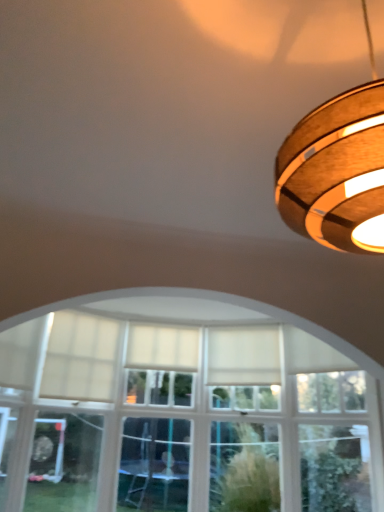
The height and width of the screenshot is (512, 384). What do you see at coordinates (163, 346) in the screenshot?
I see `white fabric curtain at center, which is counted as the first curtain, starting from the right` at bounding box center [163, 346].

What do you see at coordinates (80, 358) in the screenshot?
I see `white sheer curtain at center, the second curtain positioned from the right` at bounding box center [80, 358].

At what (x,y) coordinates should I click in order to perform the action: click on wooden ring light at upper right. Please return your answer as a coordinate pair (x, y). This screenshot has height=512, width=384. Looking at the image, I should click on (336, 172).

In terms of height, does white sheer curtain at center, which is counted as the first curtain, starting from the left, look taller or shorter compared to white fabric curtain at center, which is counted as the first curtain, starting from the right?

white sheer curtain at center, which is counted as the first curtain, starting from the left, is taller than white fabric curtain at center, which is counted as the first curtain, starting from the right.

Is white sheer curtain at center, which is counted as the first curtain, starting from the left, behind white fabric curtain at center, the 2th curtain when ordered from left to right?

No, white sheer curtain at center, which is counted as the first curtain, starting from the left, is closer to the camera.

Choose the correct answer: Is white sheer curtain at center, which is counted as the first curtain, starting from the left, inside white fabric curtain at center, which is counted as the first curtain, starting from the right, or outside it?

white sheer curtain at center, which is counted as the first curtain, starting from the left, is located beyond the bounds of white fabric curtain at center, which is counted as the first curtain, starting from the right.

Between white fabric curtain at center, which is counted as the first curtain, starting from the right, and white sheer curtain at center, which is counted as the first curtain, starting from the left, which one has smaller width?

Thinner between the two is white sheer curtain at center, which is counted as the first curtain, starting from the left.

Measure the distance from white fabric curtain at center, the 2th curtain when ordered from left to right, to white sheer curtain at center, the second curtain positioned from the right.

19.10 inches.

Which is more to the left, white fabric curtain at center, the 2th curtain when ordered from left to right, or white sheer curtain at center, the second curtain positioned from the right?

white sheer curtain at center, the second curtain positioned from the right, is more to the left.

Consider the image. From a real-world perspective, who is located higher, white fabric curtain at center, the 2th curtain when ordered from left to right, or white sheer curtain at center, which is counted as the first curtain, starting from the left?

In real-world perspective, white fabric curtain at center, the 2th curtain when ordered from left to right, is above.

Who is shorter, wooden ring light at upper right or white sheer curtain at center, the second curtain positioned from the right?

With less height is white sheer curtain at center, the second curtain positioned from the right.

In terms of size, does wooden ring light at upper right appear bigger or smaller than white sheer curtain at center, the second curtain positioned from the right?

Considering their sizes, wooden ring light at upper right takes up more space than white sheer curtain at center, the second curtain positioned from the right.

Is wooden ring light at upper right oriented away from white sheer curtain at center, which is counted as the first curtain, starting from the left?

Correct, wooden ring light at upper right is looking away from white sheer curtain at center, which is counted as the first curtain, starting from the left.

Locate an element on the screen. The width and height of the screenshot is (384, 512). lamp to the right of white sheer curtain at center, which is counted as the first curtain, starting from the left is located at coordinates (336, 172).

Considering the points (112, 381) and (367, 152), which point is behind, point (112, 381) or point (367, 152)?

The point (112, 381) is farther.

Where is `curtain that is the 2nd one below the wooden ring light at upper right (from a real-world perspective)`? Image resolution: width=384 pixels, height=512 pixels. curtain that is the 2nd one below the wooden ring light at upper right (from a real-world perspective) is located at coordinates (x=80, y=358).

From the image's perspective, which is below, white sheer curtain at center, which is counted as the first curtain, starting from the left, or wooden ring light at upper right?

From the image's view, white sheer curtain at center, which is counted as the first curtain, starting from the left, is below.

Can you confirm if white sheer curtain at center, the second curtain positioned from the right, is positioned to the left of wooden ring light at upper right?

Correct, you'll find white sheer curtain at center, the second curtain positioned from the right, to the left of wooden ring light at upper right.

Is point (371, 183) closer to camera compared to point (192, 342)?

Yes.

Is wooden ring light at upper right turned away from white fabric curtain at center, the 2th curtain when ordered from left to right?

Absolutely, wooden ring light at upper right is directed away from white fabric curtain at center, the 2th curtain when ordered from left to right.

From the image's perspective, is wooden ring light at upper right located above white fabric curtain at center, the 2th curtain when ordered from left to right?

Indeed, from the image's perspective, wooden ring light at upper right is shown above white fabric curtain at center, the 2th curtain when ordered from left to right.

Is wooden ring light at upper right spatially inside white fabric curtain at center, which is counted as the first curtain, starting from the right, or outside of it?

wooden ring light at upper right is not enclosed by white fabric curtain at center, which is counted as the first curtain, starting from the right.

Is white fabric curtain at center, which is counted as the first curtain, starting from the right, touching wooden ring light at upper right?

No, white fabric curtain at center, which is counted as the first curtain, starting from the right, is not making contact with wooden ring light at upper right.

Looking at the image, does white fabric curtain at center, which is counted as the first curtain, starting from the right, seem bigger or smaller compared to wooden ring light at upper right?

Clearly, white fabric curtain at center, which is counted as the first curtain, starting from the right, is smaller in size than wooden ring light at upper right.

Is point (134, 334) closer to camera compared to point (317, 180)?

No, (134, 334) is behind (317, 180).

Where is `the 1st curtain located beneath the wooden ring light at upper right (from a real-world perspective)`? Image resolution: width=384 pixels, height=512 pixels. the 1st curtain located beneath the wooden ring light at upper right (from a real-world perspective) is located at coordinates (163, 346).

Where is `curtain on the left of white fabric curtain at center, which is counted as the first curtain, starting from the right`? The height and width of the screenshot is (512, 384). curtain on the left of white fabric curtain at center, which is counted as the first curtain, starting from the right is located at coordinates (80, 358).

Identify the location of curtain below the white fabric curtain at center, the 2th curtain when ordered from left to right (from the image's perspective). The width and height of the screenshot is (384, 512). (80, 358).

Estimate the real-world distances between objects in this image. Which object is further from white fabric curtain at center, which is counted as the first curtain, starting from the right, wooden ring light at upper right or white sheer curtain at center, the second curtain positioned from the right?

Based on the image, wooden ring light at upper right appears to be further to white fabric curtain at center, which is counted as the first curtain, starting from the right.

Based on the photo, considering their positions, is wooden ring light at upper right positioned closer to white sheer curtain at center, which is counted as the first curtain, starting from the left, than white fabric curtain at center, which is counted as the first curtain, starting from the right?

white fabric curtain at center, which is counted as the first curtain, starting from the right, is closer to white sheer curtain at center, which is counted as the first curtain, starting from the left.

From the image, which object appears to be farther from wooden ring light at upper right, white sheer curtain at center, which is counted as the first curtain, starting from the left, or white fabric curtain at center, the 2th curtain when ordered from left to right?

Among the two, white fabric curtain at center, the 2th curtain when ordered from left to right, is located further to wooden ring light at upper right.

From the image, which object appears to be nearer to white fabric curtain at center, which is counted as the first curtain, starting from the right, white sheer curtain at center, which is counted as the first curtain, starting from the left, or wooden ring light at upper right?

white sheer curtain at center, which is counted as the first curtain, starting from the left, is closer to white fabric curtain at center, which is counted as the first curtain, starting from the right.

From the image, which object appears to be nearer to wooden ring light at upper right, white fabric curtain at center, which is counted as the first curtain, starting from the right, or white sheer curtain at center, which is counted as the first curtain, starting from the left?

white sheer curtain at center, which is counted as the first curtain, starting from the left, is closer to wooden ring light at upper right.

From the image, which object appears to be farther from white sheer curtain at center, which is counted as the first curtain, starting from the left, white fabric curtain at center, the 2th curtain when ordered from left to right, or wooden ring light at upper right?

wooden ring light at upper right lies further to white sheer curtain at center, which is counted as the first curtain, starting from the left, than the other object.

The width and height of the screenshot is (384, 512). In order to click on curtain located between wooden ring light at upper right and white fabric curtain at center, which is counted as the first curtain, starting from the right, in the depth direction in this screenshot , I will do `click(80, 358)`.